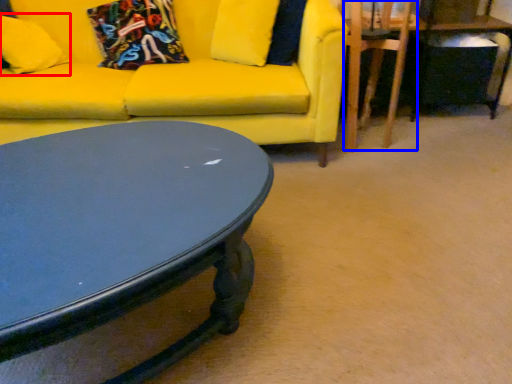
Question: Which of the following is the farthest to the observer, pillow (highlighted by a red box) or swivel chair (highlighted by a blue box)?

Choices:
 (A) pillow
 (B) swivel chair

Answer: (A)